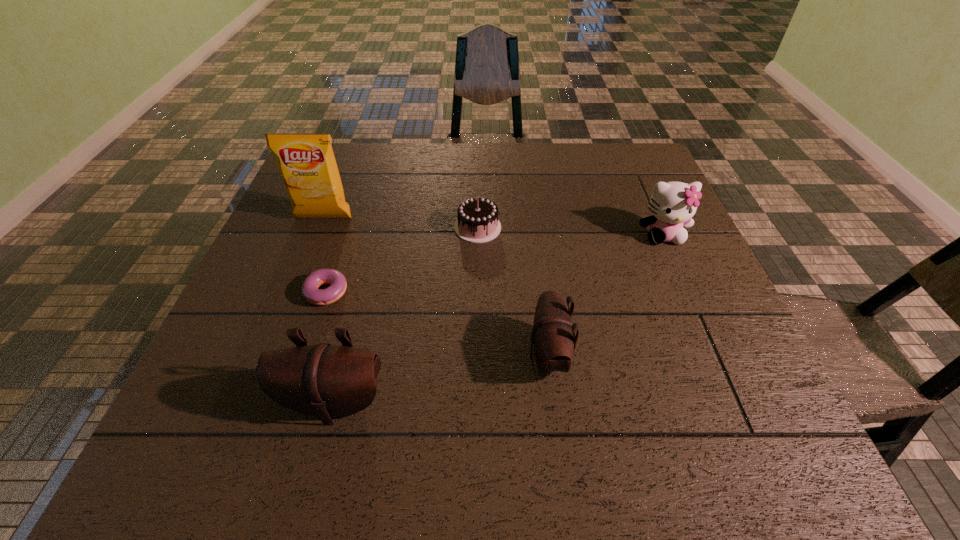
Identify the location of free space between the shortest object and the tallest object. (327, 255).

At what (x,y) coordinates should I click in order to perform the action: click on unoccupied position between the left pouch and the second shortest object. Please return your answer as a coordinate pair (x, y). The image size is (960, 540). Looking at the image, I should click on (406, 315).

Locate an element on the screen. The image size is (960, 540). vacant region between the doughnut and the second shortest object is located at coordinates (405, 260).

Find the location of a particular element. The height and width of the screenshot is (540, 960). empty space between the doughnut and the third shortest object is located at coordinates (440, 324).

Where is `unoccupied area between the crisp (potato chip) and the shortest object`? This screenshot has width=960, height=540. unoccupied area between the crisp (potato chip) and the shortest object is located at coordinates (327, 255).

I want to click on object that is the nearest to the shortest object, so click(326, 381).

Where is `the closest object to the right pouch`? Image resolution: width=960 pixels, height=540 pixels. the closest object to the right pouch is located at coordinates (477, 222).

Image resolution: width=960 pixels, height=540 pixels. What are the coordinates of `vacant space that satisfies the following two spatial constraints: 1. on the back side of the fourth farthest object; 2. on the left side of the fourth object from left to right` in the screenshot? It's located at (352, 227).

At what (x,y) coordinates should I click in order to perform the action: click on vacant space that satisfies the following two spatial constraints: 1. with the flap open on the right pouch; 2. with the flap open on the left pouch. Please return your answer as a coordinate pair (x, y). Looking at the image, I should click on (554, 403).

Locate an element on the screen. This screenshot has height=540, width=960. vacant position in the image that satisfies the following two spatial constraints: 1. on the front-facing side of the rightmost object; 2. with the flap open on the right pouch is located at coordinates (715, 355).